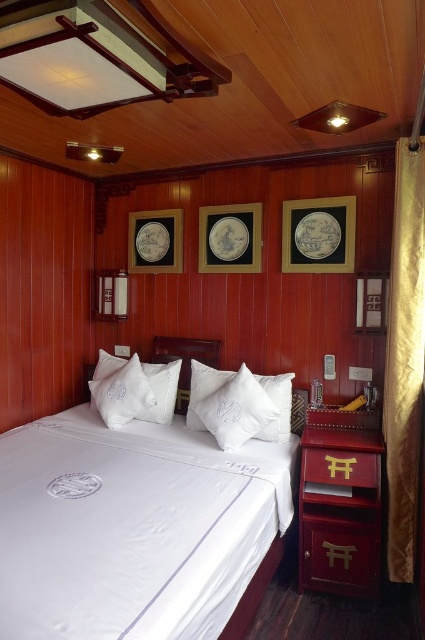
Question: Which point appears farthest from the camera in this image?

Choices:
 (A) (399, 435)
 (B) (197, 365)

Answer: (B)

Question: Which point is closer to the camera taking this photo?

Choices:
 (A) (105, 428)
 (B) (390, 292)

Answer: (B)

Question: Which of the following is the closest to the observer?

Choices:
 (A) gold textured curtain at right
 (B) matte black picture frame at upper right
 (C) white satin bed at center

Answer: (C)

Question: Can you confirm if matte black picture frame at upper right is positioned above white down pillow at center?

Choices:
 (A) no
 (B) yes

Answer: (B)

Question: Can you confirm if white satin bed at center is positioned to the left of matte black picture frame at center?

Choices:
 (A) no
 (B) yes

Answer: (B)

Question: Can you confirm if matte black picture frame at upper right is wider than matte black picture frame at upper left?

Choices:
 (A) no
 (B) yes

Answer: (A)